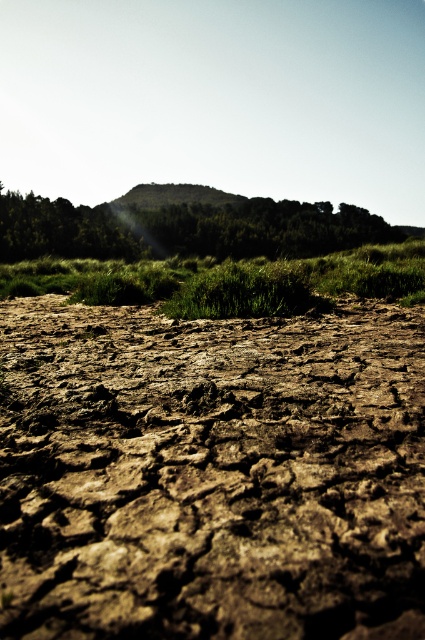
Question: Does green grass at center have a greater width compared to green matte grass at center?

Choices:
 (A) yes
 (B) no

Answer: (A)

Question: Which object appears closest to the camera in this image?

Choices:
 (A) brown cracked soil at center
 (B) green matte grass at center
 (C) green grassy hill at upper center
 (D) green grass at center

Answer: (A)

Question: Does green grassy hill at upper center have a smaller size compared to green matte grass at center?

Choices:
 (A) no
 (B) yes

Answer: (A)

Question: Does brown cracked soil at center lie behind green grass at center?

Choices:
 (A) yes
 (B) no

Answer: (B)

Question: Which object appears farthest from the camera in this image?

Choices:
 (A) green grassy hill at upper center
 (B) green matte grass at center
 (C) brown cracked soil at center

Answer: (A)

Question: Which is farther from the green grassy hill at upper center?

Choices:
 (A) green grass at center
 (B) green matte grass at center

Answer: (B)